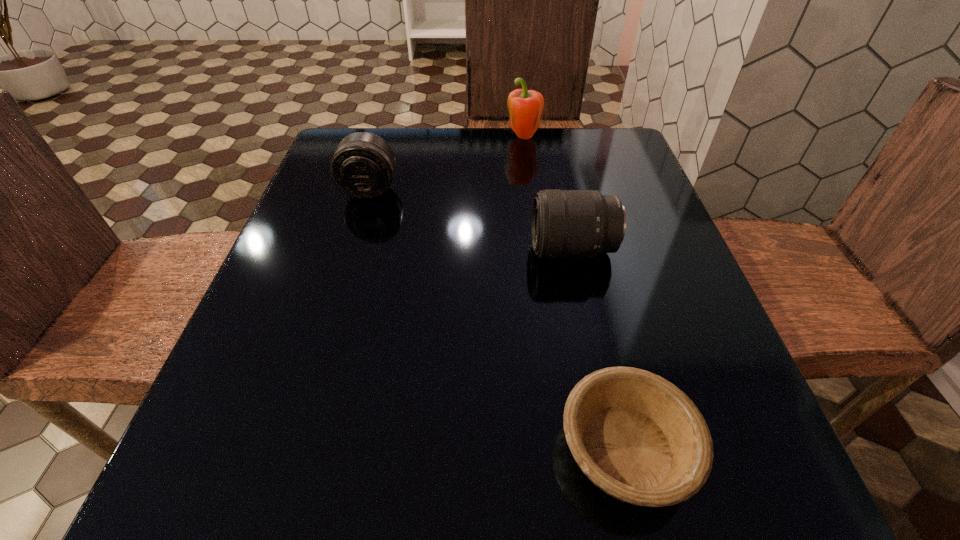
This screenshot has width=960, height=540. Find the location of `vacant area that satisfies the following two spatial constraints: 1. on the surface of the shortest object; 2. on the right side of the third farthest object`. vacant area that satisfies the following two spatial constraints: 1. on the surface of the shortest object; 2. on the right side of the third farthest object is located at coordinates (615, 448).

Find the location of a particular element. This screenshot has height=540, width=960. blank space that satisfies the following two spatial constraints: 1. on the front-facing side of the leftmost object; 2. on the right side of the bowl is located at coordinates (293, 448).